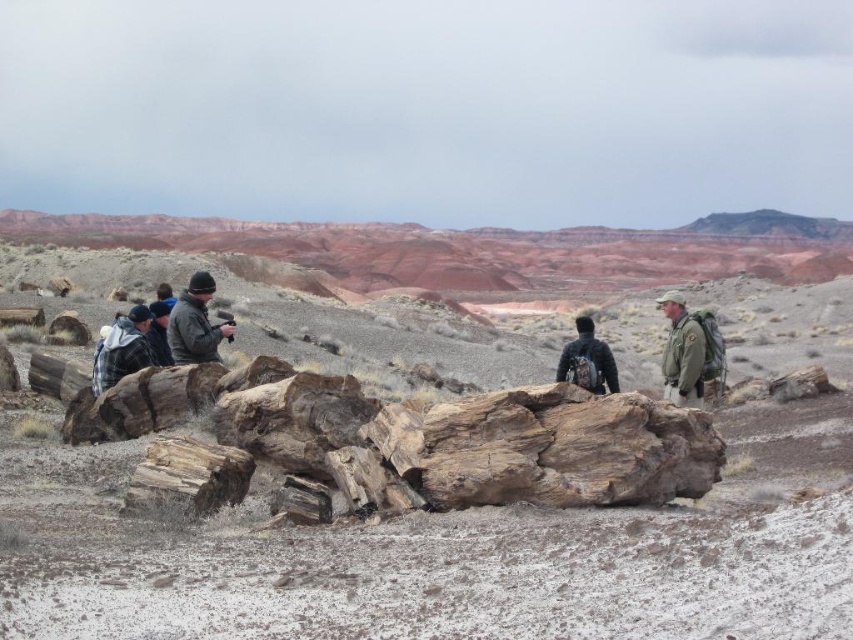
Question: Which point is farther to the camera?

Choices:
 (A) rusty wood log at center
 (B) plaid fabric jacket at left
 (C) dark gray wool jacket at center

Answer: (C)

Question: Does weathered wood at center appear on the left side of rusty wood log at center?

Choices:
 (A) no
 (B) yes

Answer: (A)

Question: Which object appears farthest from the camera in this image?

Choices:
 (A) plaid fabric jacket at left
 (B) rusty wood log at center

Answer: (A)

Question: Which object is farther from the camera taking this photo?

Choices:
 (A) rusty wood log at center
 (B) green uniform at center
 (C) dark gray wool jacket at center

Answer: (C)

Question: Does weathered wood at center appear under dark gray wool jacket at center?

Choices:
 (A) no
 (B) yes

Answer: (B)

Question: Is weathered wood at center in front of rusty wood log at center?

Choices:
 (A) no
 (B) yes

Answer: (B)